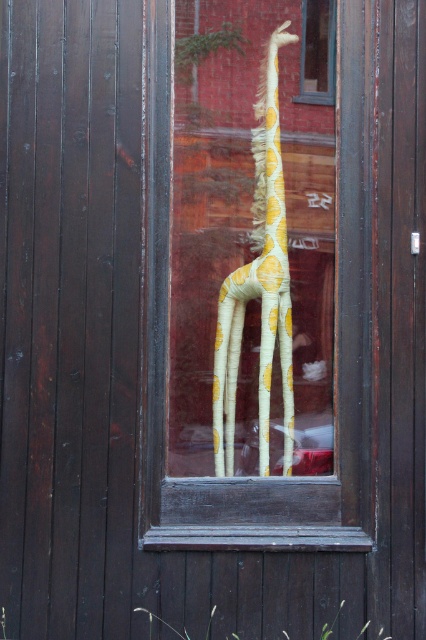
Who is positioned more to the left, yellow paper giraffe at center or transparent glass window at upper center?

Positioned to the left is yellow paper giraffe at center.

Between yellow paper giraffe at center and transparent glass window at upper center, which one appears on the right side from the viewer's perspective?

Positioned to the right is transparent glass window at upper center.

Does point (268, 163) lie in front of point (327, 72)?

No, (268, 163) is behind (327, 72).

Locate an element on the screen. yellow paper giraffe at center is located at coordinates (259, 284).

Does wooden frame at center have a greater height compared to transparent glass window at upper center?

Indeed, wooden frame at center has a greater height compared to transparent glass window at upper center.

Who is more forward, (267,77) or (316,97)?

Point (316,97) is in front.

Is point (252, 10) positioned before point (333, 28)?

That is False.

You are a GUI agent. You are given a task and a screenshot of the screen. Output one action in this format:
    pyautogui.click(x=<x>, y=<y>)
    Task: Click on the wooden frame at center
    The width and height of the screenshot is (426, 640).
    Given the screenshot: What is the action you would take?
    pyautogui.click(x=252, y=289)

Who is taller, wooden frame at center or yellow paper giraffe at center?

wooden frame at center

Is point (261, 285) positioned after point (276, 122)?

No, (261, 285) is closer to viewer.

The image size is (426, 640). What do you see at coordinates (252, 289) in the screenshot? I see `wooden frame at center` at bounding box center [252, 289].

Identify the location of wooden frame at center. (252, 289).